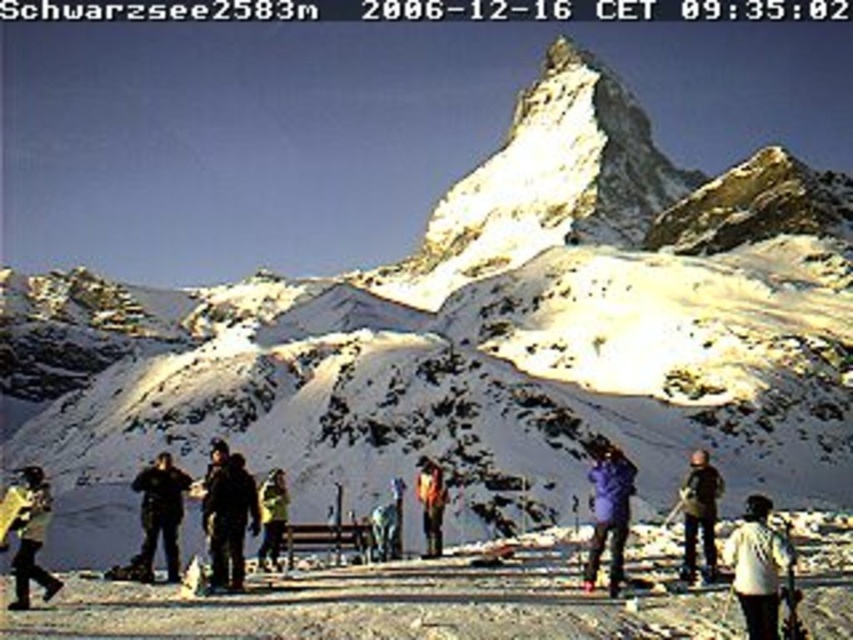
You are a photographer trying to capture a group photo of the yellow fabric jacket at center and the orange fabric jacket at center. Which jacket should you focus on first if you want to ensure it appears bigger in the photo?

The yellow fabric jacket at center is larger in size than the orange fabric jacket at center, so you should focus on the yellow fabric jacket at center first to ensure it appears bigger in the photo.

You are standing at point (x=402, y=604) in the snowy mountain landscape. What is the terrain like at your current location?

The terrain at point (x=402, y=604) is white snow at center.